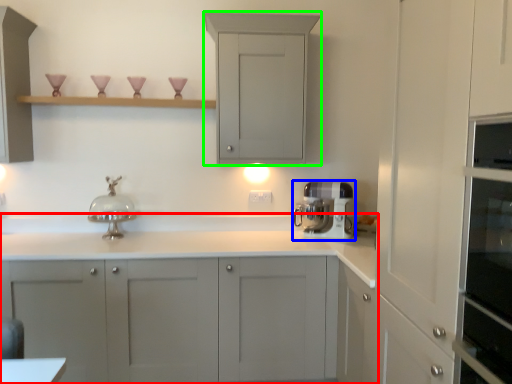
Question: Considering the real-world distances, which object is farthest from cabinetry (highlighted by a red box)? home appliance (highlighted by a blue box) or cabinetry (highlighted by a green box)?

Choices:
 (A) home appliance
 (B) cabinetry

Answer: (B)